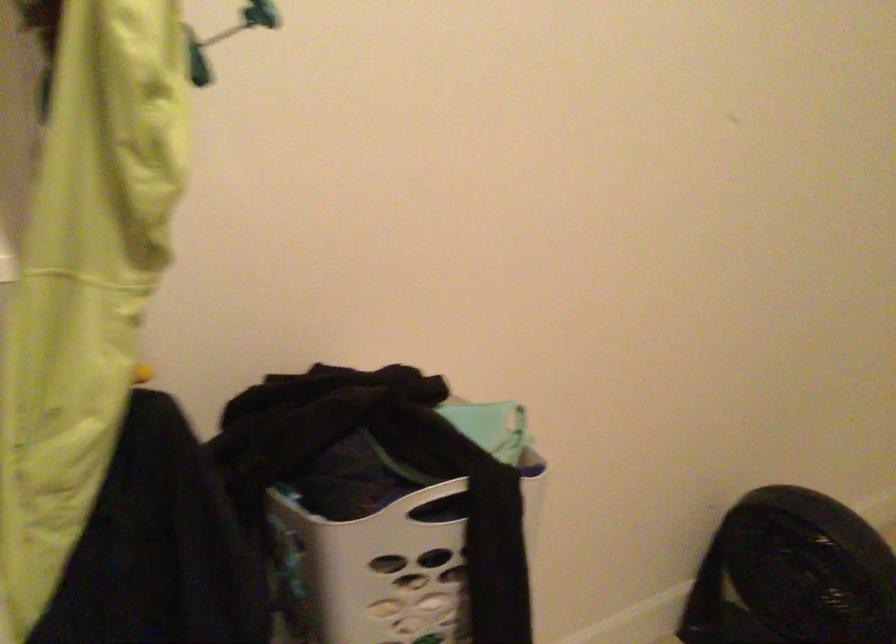
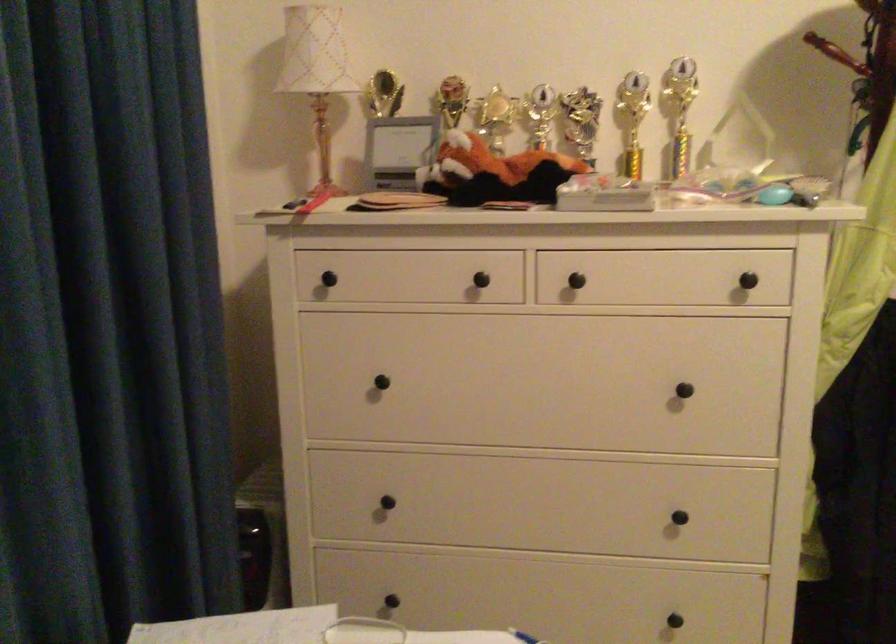
Question: How did the camera likely rotate?

Choices:
 (A) Left
 (B) Right
 (C) Up
 (D) Down

Answer: (A)